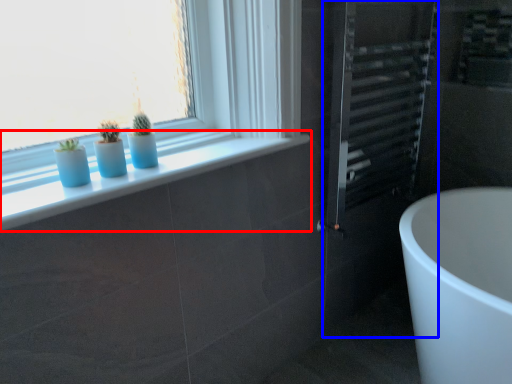
Question: Which object appears farthest to the camera in this image, window sill (highlighted by a red box) or screen door (highlighted by a blue box)?

Choices:
 (A) window sill
 (B) screen door

Answer: (B)